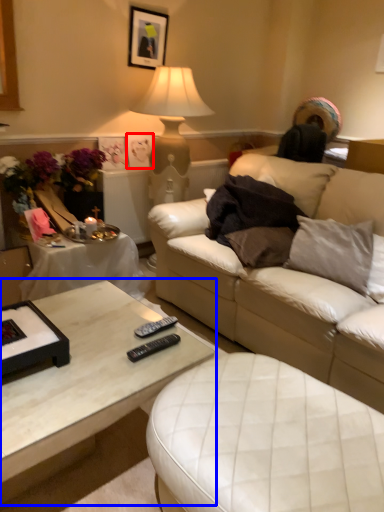
Question: Which point is closer to the camera, picture frame (highlighted by a red box) or coffee table (highlighted by a blue box)?

Choices:
 (A) picture frame
 (B) coffee table

Answer: (B)